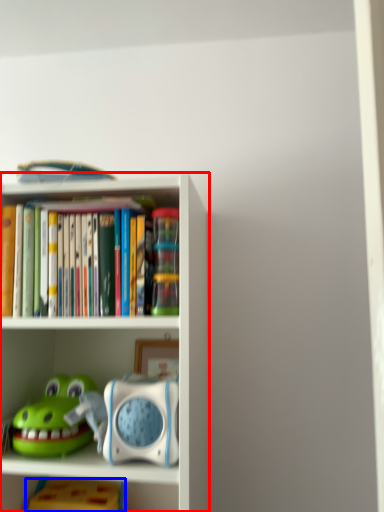
Question: Which object is closer to the camera taking this photo, shelf (highlighted by a red box) or toy (highlighted by a blue box)?

Choices:
 (A) shelf
 (B) toy

Answer: (A)